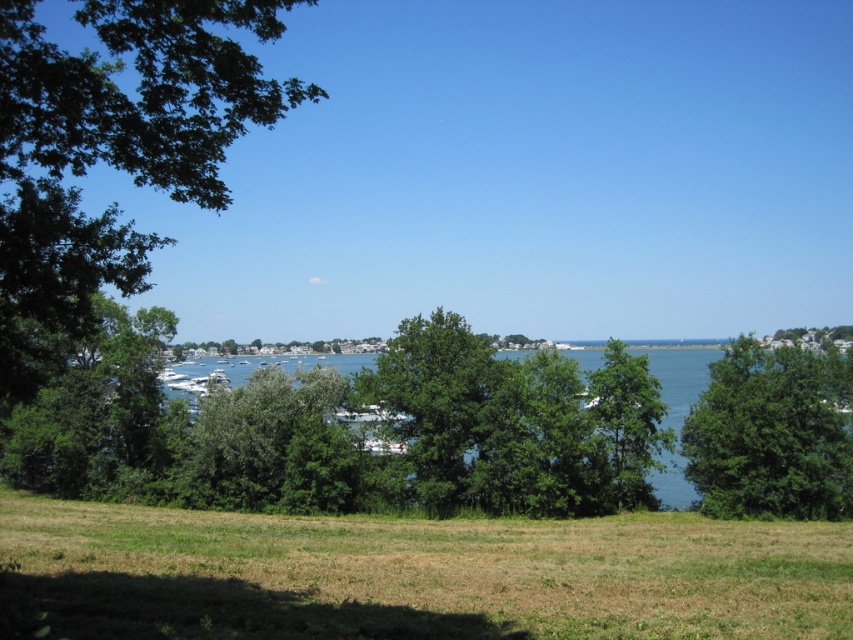
Is green grassy field at lower center bigger than green leafy tree at center-right?

Yes, green grassy field at lower center is bigger than green leafy tree at center-right.

Who is taller, green grassy field at lower center or green leafy tree at center-right?

green leafy tree at center-right is taller.

Is point (6, 570) less distant than point (596, 369)?

That is True.

Identify the location of green grassy field at lower center. This screenshot has height=640, width=853. (415, 573).

Is green leafy tree at right closer to the viewer compared to green leafy tree at center?

Yes.

Between point (778, 486) and point (477, 404), which one is positioned in front?

Point (778, 486) is more forward.

Where is `green leafy tree at right`? The height and width of the screenshot is (640, 853). green leafy tree at right is located at coordinates (772, 435).

Is green leafy tree at right closer to camera compared to green leafy tree at center-right?

Yes, green leafy tree at right is closer to the viewer.

Is green leafy tree at right wider than green leafy tree at center-right?

Yes.

This screenshot has width=853, height=640. In order to click on green leafy tree at right in this screenshot , I will do `click(772, 435)`.